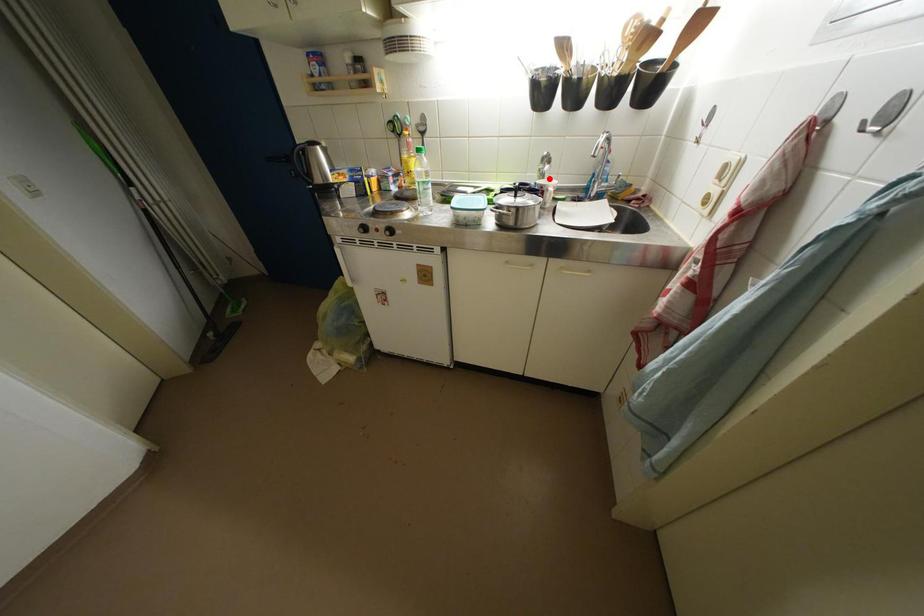
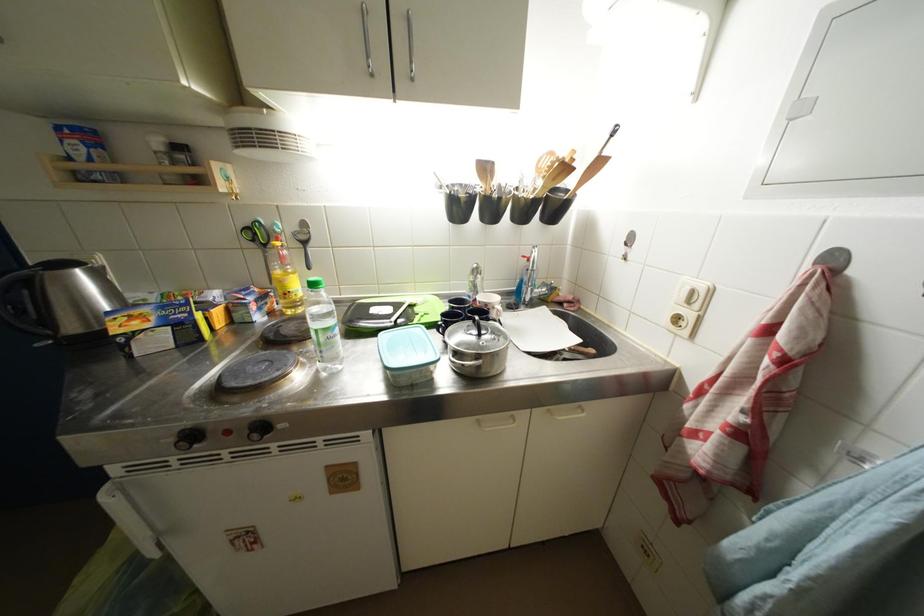
In the second image, find the point that corresponds to the highlighted location in the first image.

(481, 291)